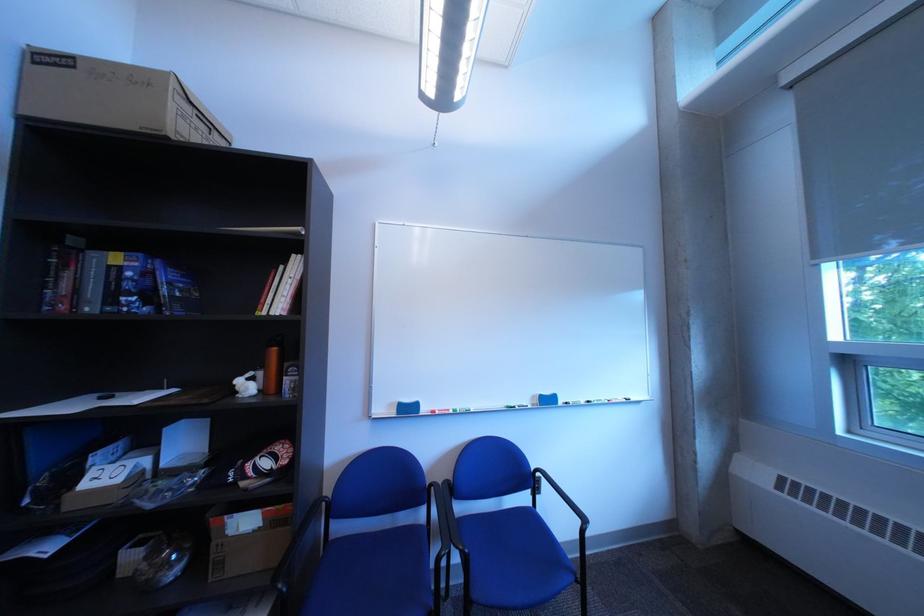
The height and width of the screenshot is (616, 924). Find the location of `black chair armrest`. black chair armrest is located at coordinates [x=555, y=493].